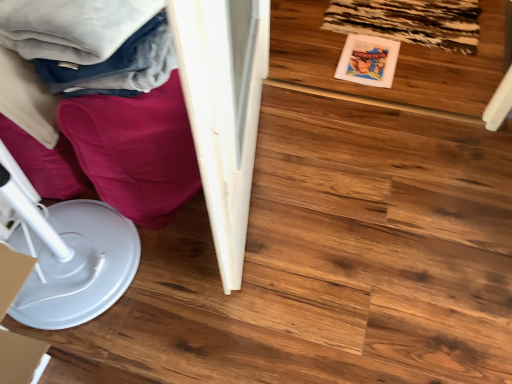
Question: Considering the positions of soft cotton blanket at upper left and white plastic paper plate at lower left in the image, is soft cotton blanket at upper left wider or thinner than white plastic paper plate at lower left?

Choices:
 (A) thin
 (B) wide

Answer: (B)

Question: From the image's perspective, is soft cotton blanket at upper left located above or below white plastic paper plate at lower left?

Choices:
 (A) above
 (B) below

Answer: (A)

Question: Which object is the farthest from the soft cotton blanket at upper left?

Choices:
 (A) white plastic paper plate at lower left
 (B) white glossy wardrobe at left
 (C) wooden floor at center

Answer: (C)

Question: Which object is positioned closest to the white plastic paper plate at lower left?

Choices:
 (A) soft cotton blanket at upper left
 (B) wooden floor at center
 (C) white glossy wardrobe at left

Answer: (C)